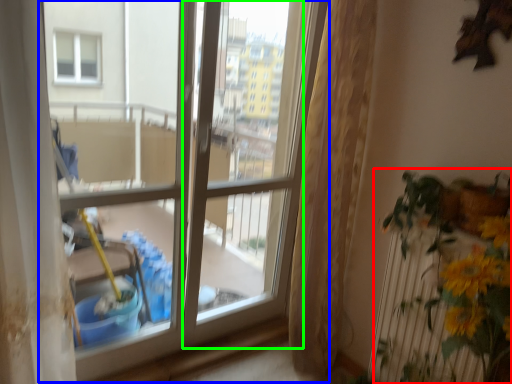
Question: Considering the real-world distances, which object is closest to houseplant (highlighted by a red box)? window (highlighted by a blue box) or screen door (highlighted by a green box).

Choices:
 (A) window
 (B) screen door

Answer: (A)